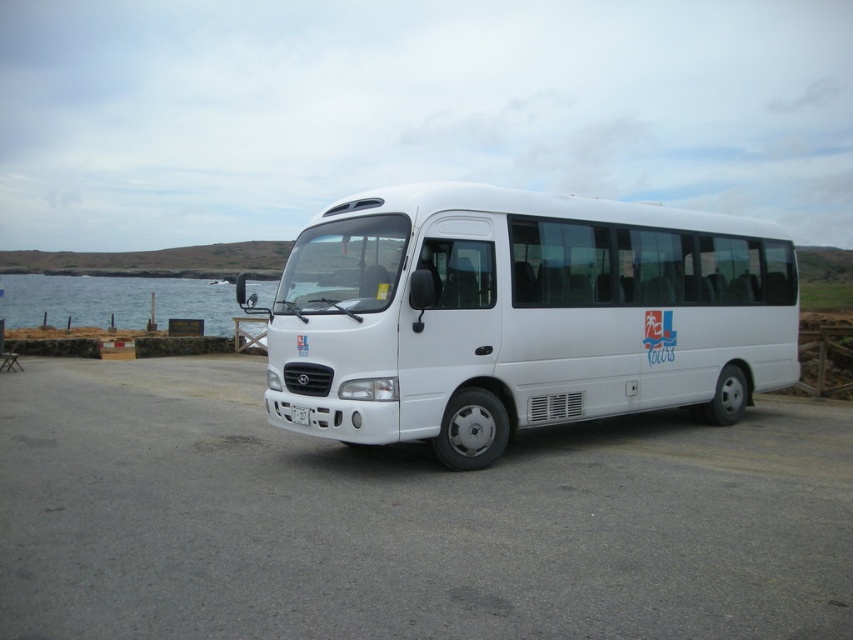
Question: Which of the following is the closest to the observer?

Choices:
 (A) [x=299, y=269]
 (B) [x=641, y=536]

Answer: (B)

Question: Which point appears farthest from the camera in this image?

Choices:
 (A) click(51, 554)
 (B) click(94, 301)

Answer: (B)

Question: Is white asphalt parking lot at center positioned at the back of blue water at left?

Choices:
 (A) no
 (B) yes

Answer: (A)

Question: Among these objects, which one is farthest from the camera?

Choices:
 (A) white matte bus at center
 (B) white asphalt parking lot at center
 (C) blue water at left

Answer: (C)

Question: Is white asphalt parking lot at center above blue water at left?

Choices:
 (A) yes
 (B) no

Answer: (B)

Question: Is white asphalt parking lot at center further to camera compared to blue water at left?

Choices:
 (A) yes
 (B) no

Answer: (B)